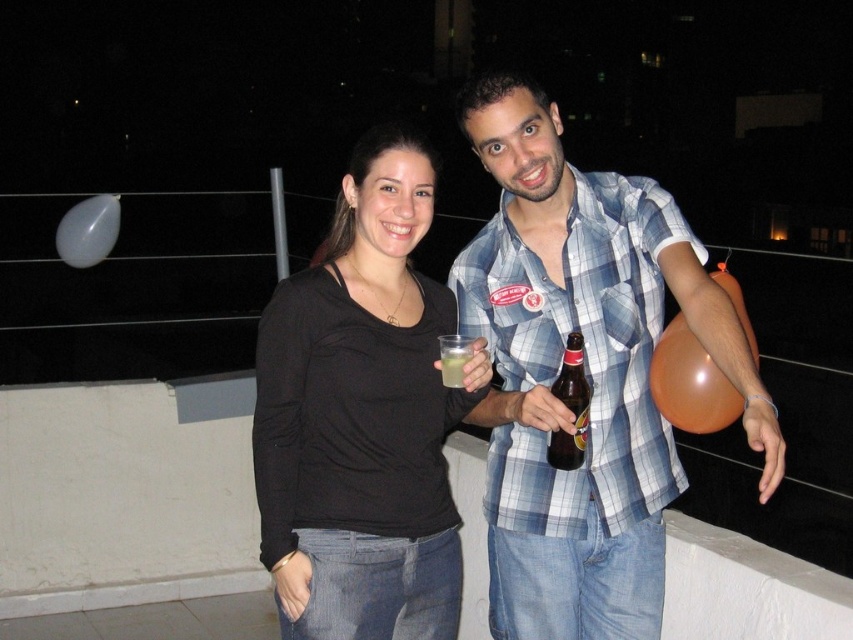
Question: Which object is closer to the camera taking this photo?

Choices:
 (A) matte plastic beer bottle at center
 (B) brown glass bottle at center
 (C) orange rubber balloon at right
 (D) black matte shirt at center

Answer: (C)

Question: Can you confirm if transparent plastic balloon at upper left is thinner than matte plastic beer bottle at center?

Choices:
 (A) no
 (B) yes

Answer: (A)

Question: Among these points, which one is farthest from the camera?

Choices:
 (A) (599, 241)
 (B) (453, 600)
 (C) (572, 401)
 (D) (558, 404)

Answer: (B)

Question: Which object is positioned farthest from the black matte shirt at center?

Choices:
 (A) translucent plastic cup at center
 (B) matte plastic beer bottle at center
 (C) orange rubber balloon at right

Answer: (C)

Question: Is orange rubber balloon at right wider than transparent plastic balloon at upper left?

Choices:
 (A) yes
 (B) no

Answer: (B)

Question: Is orange rubber balloon at right positioned in front of brown glass bottle at center?

Choices:
 (A) yes
 (B) no

Answer: (A)